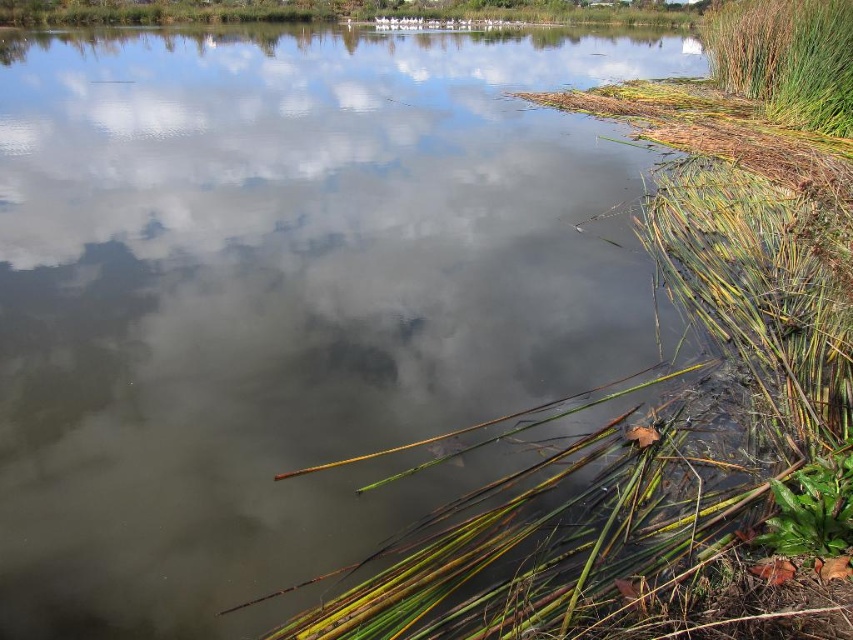
Question: Is green grass at right further to camera compared to green leafy plant at lower right?

Choices:
 (A) no
 (B) yes

Answer: (B)

Question: Which of the following is the closest to the observer?

Choices:
 (A) green grass at right
 (B) green leafy plant at lower right

Answer: (B)

Question: Does green grass at right appear over green leafy plant at lower right?

Choices:
 (A) yes
 (B) no

Answer: (A)

Question: Which point appears farthest from the camera in this image?

Choices:
 (A) (801, 3)
 (B) (769, 536)

Answer: (A)

Question: Does green grass at right appear on the right side of green leafy plant at lower right?

Choices:
 (A) no
 (B) yes

Answer: (B)